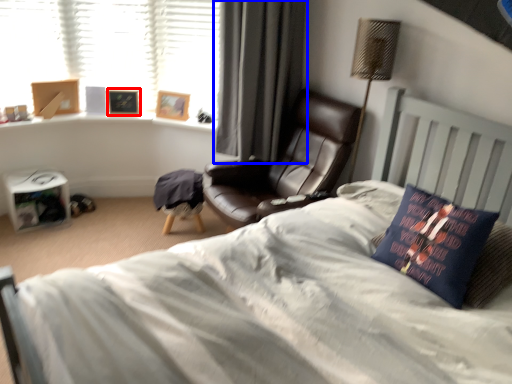
Question: Which object appears farthest to the camera in this image, picture frame (highlighted by a red box) or curtain (highlighted by a blue box)?

Choices:
 (A) picture frame
 (B) curtain

Answer: (A)